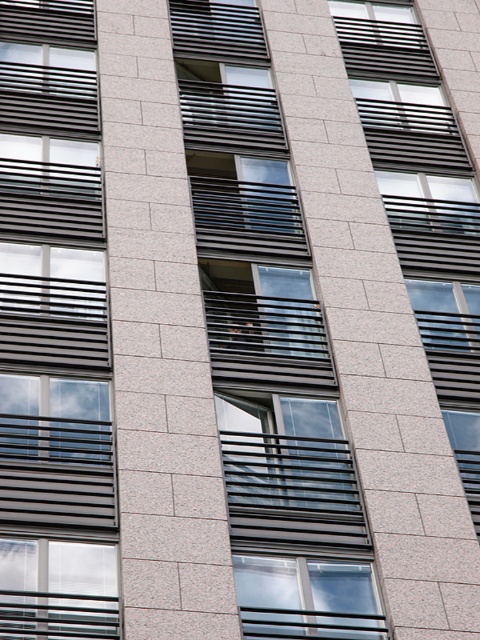
You are standing in front of the building and notice two windows. One is the matte black window at center and the other is the clear glass window at lower left. Which window is positioned higher up on the building?

The matte black window at center is positioned higher up on the building than the clear glass window at lower left because it is located above it.

You are a window installer assessing the building facade. You have two clear glass windows to install. The first is for the clear glass window at lower left and the second for the clear glass window at center. Which window requires a wider frame?

The clear glass window at center requires a wider frame because its width is greater than the clear glass window at lower left.

Based on the photo, you are an architect designing a new building inspired by this facade. You need to ensure that the central window is visually dominant. Given the existing design elements, how does the matte black window at center compare in height to the matte black window at left in the provided image?

The matte black window at center is much taller than the matte black window at left, making it visually dominant due to its increased height.